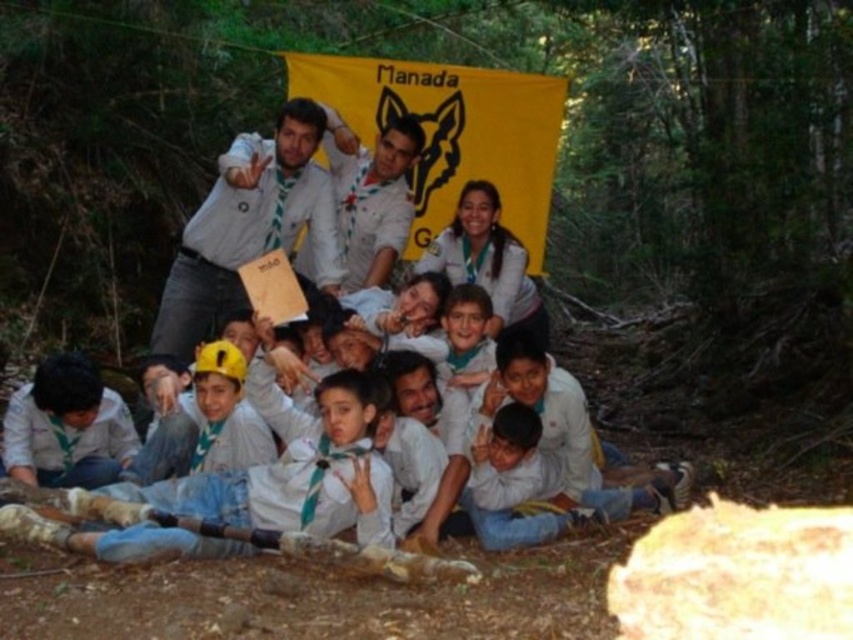
Question: Which object is the farthest from the matte white shirt at center?

Choices:
 (A) yellow matte helmet at center
 (B) white fabric shirt at center

Answer: (A)

Question: Which object appears farthest from the camera in this image?

Choices:
 (A) white fabric shirt at center
 (B) white cotton shirt at center
 (C) matte white shirt at center
 (D) yellow matte helmet at center

Answer: (A)

Question: Considering the relative positions of matte white shirt at center and white fabric shirt at center in the image provided, where is matte white shirt at center located with respect to white fabric shirt at center?

Choices:
 (A) left
 (B) right

Answer: (A)

Question: Can you confirm if matte white shirt at center is positioned to the left of white fabric shirt at center?

Choices:
 (A) yes
 (B) no

Answer: (A)

Question: Can you confirm if white cotton shirt at center is thinner than matte white shirt at center?

Choices:
 (A) no
 (B) yes

Answer: (A)

Question: Which of these objects is positioned farthest from the matte white shirt at center?

Choices:
 (A) yellow matte helmet at center
 (B) white fabric shirt at center
 (C) white cotton shirt at center

Answer: (C)